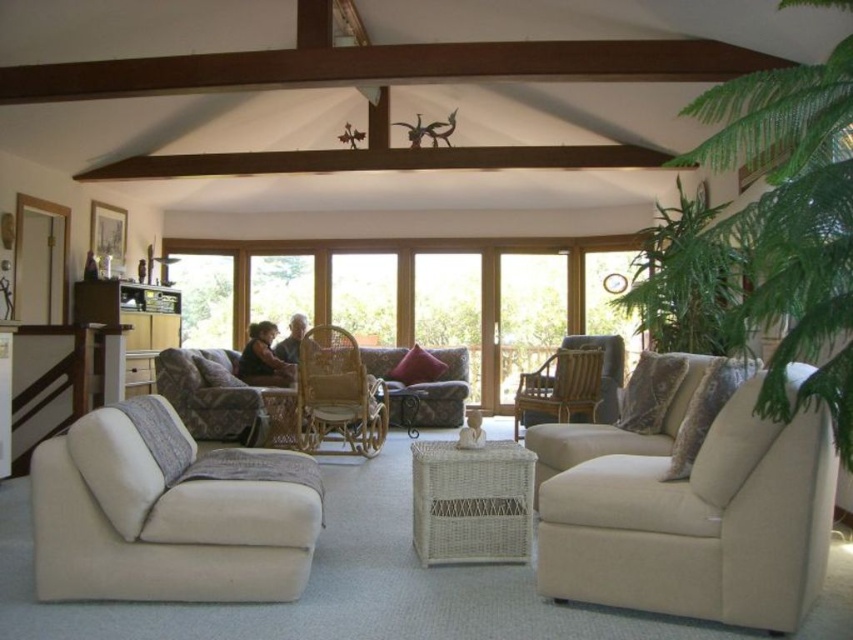
Question: Is light brown woven armchair at center below transparent glass window at center?

Choices:
 (A) no
 (B) yes

Answer: (B)

Question: Which point is closer to the camera?

Choices:
 (A) (283, 541)
 (B) (302, 387)
 (C) (282, 340)

Answer: (A)

Question: Which of the following is the farthest from the observer?

Choices:
 (A) transparent glass window at center
 (B) beige fabric couch at lower right

Answer: (A)

Question: Is light brown woven armchair at center bigger than smooth beige sweater at center?

Choices:
 (A) no
 (B) yes

Answer: (B)

Question: Which point is closer to the camera taking this photo?

Choices:
 (A) (831, 291)
 (B) (343, 413)

Answer: (A)

Question: Is green leafy plant at right to the left of beige fabric couch at lower left from the viewer's perspective?

Choices:
 (A) yes
 (B) no

Answer: (B)